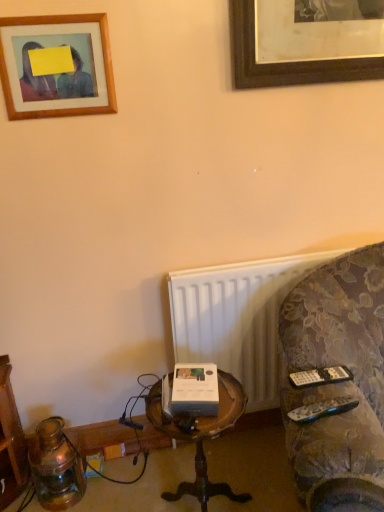
The image size is (384, 512). Describe the element at coordinates (56, 66) in the screenshot. I see `wooden picture frame at upper left` at that location.

The image size is (384, 512). Describe the element at coordinates (322, 409) in the screenshot. I see `black plastic remote at lower right, the second remote positioned from the back` at that location.

This screenshot has width=384, height=512. In order to click on antique brass lantern at lower left in this screenshot , I will do `click(56, 466)`.

In order to click on black plastic remote at right, the 1th remote in the back-to-front sequence in this screenshot , I will do `click(320, 376)`.

At what (x,y) coordinates should I click in order to perform the action: click on wooden picture frame at upper left. Please return your answer as a coordinate pair (x, y). The width and height of the screenshot is (384, 512). Looking at the image, I should click on (56, 66).

Are black plastic remote at lower right, the second remote positioned from the back, and white plastic radiator at lower right far apart?

black plastic remote at lower right, the second remote positioned from the back, is actually quite close to white plastic radiator at lower right.

How many degrees apart are the facing directions of black plastic remote at lower right, the second remote positioned from the back, and white plastic radiator at lower right?

The angular difference between black plastic remote at lower right, the second remote positioned from the back, and white plastic radiator at lower right is 4.05 degrees.

Which is more to the left, black plastic remote at lower right, the second remote positioned from the back, or white plastic radiator at lower right?

white plastic radiator at lower right is more to the left.

From a real-world perspective, between black plastic remote at lower right, which appears as the first remote when viewed from the front, and white plastic radiator at lower right, who is vertically higher?

From a 3D spatial view, black plastic remote at lower right, which appears as the first remote when viewed from the front, is above.

Considering the sizes of objects velvet-patterned couch at right and white plastic radiator at lower right in the image provided, who is thinner, velvet-patterned couch at right or white plastic radiator at lower right?

With smaller width is white plastic radiator at lower right.

Can you confirm if velvet-patterned couch at right is smaller than white plastic radiator at lower right?

No.

From a real-world perspective, does velvet-patterned couch at right stand above white plastic radiator at lower right?

Correct, in the physical world, velvet-patterned couch at right is higher than white plastic radiator at lower right.

Could you tell me if velvet-patterned couch at right is turned towards white plastic radiator at lower right?

No, velvet-patterned couch at right is not oriented towards white plastic radiator at lower right.

Find the location of a particular element. Image resolution: width=384 pixels, height=512 pixels. remote that is the 2nd object located above the velvet-patterned couch at right (from the image's perspective) is located at coordinates (320, 376).

Do you think black plastic remote at right, the 1th remote in the back-to-front sequence, is within velvet-patterned couch at right, or outside of it?

black plastic remote at right, the 1th remote in the back-to-front sequence, is inside velvet-patterned couch at right.

Does black plastic remote at right, which is the 2th remote from front to back, have a greater height compared to velvet-patterned couch at right?

In fact, black plastic remote at right, which is the 2th remote from front to back, may be shorter than velvet-patterned couch at right.

Considering the positions of objects black plastic remote at right, the 1th remote in the back-to-front sequence, and antique brass lantern at lower left in the image provided, who is more to the right, black plastic remote at right, the 1th remote in the back-to-front sequence, or antique brass lantern at lower left?

black plastic remote at right, the 1th remote in the back-to-front sequence, is more to the right.

Can you confirm if black plastic remote at right, which is the 2th remote from front to back, is thinner than antique brass lantern at lower left?

Yes.

Considering the positions of points (306, 374) and (70, 449), is point (306, 374) closer to camera compared to point (70, 449)?

Yes, point (306, 374) is in front of point (70, 449).

Find the location of a particular element. the 2nd remote in front of the white plastic radiator at lower right is located at coordinates (322, 409).

How many degrees apart are the facing directions of white plastic radiator at lower right and black plastic remote at lower right, the second remote positioned from the back?

The angle between the facing direction of white plastic radiator at lower right and the facing direction of black plastic remote at lower right, the second remote positioned from the back, is 4.05 degrees.

Are white plastic radiator at lower right and black plastic remote at lower right, which appears as the first remote when viewed from the front, making contact?

white plastic radiator at lower right and black plastic remote at lower right, which appears as the first remote when viewed from the front, are not in contact.

Could black plastic remote at lower right, which appears as the first remote when viewed from the front, be considered to be inside white plastic radiator at lower right?

No, white plastic radiator at lower right does not contain black plastic remote at lower right, which appears as the first remote when viewed from the front.

Would you consider black plastic remote at right, the 1th remote in the back-to-front sequence, to be distant from wooden picture frame at upper left?

Absolutely, black plastic remote at right, the 1th remote in the back-to-front sequence, is distant from wooden picture frame at upper left.

Consider the image. Between black plastic remote at right, the 1th remote in the back-to-front sequence, and wooden picture frame at upper left, which one has smaller size?

Smaller between the two is black plastic remote at right, the 1th remote in the back-to-front sequence.

From a real-world perspective, who is located higher, black plastic remote at right, which is the 2th remote from front to back, or wooden picture frame at upper left?

wooden picture frame at upper left.

Is black plastic remote at right, the 1th remote in the back-to-front sequence, thinner than wooden picture frame at upper left?

In fact, black plastic remote at right, the 1th remote in the back-to-front sequence, might be wider than wooden picture frame at upper left.

From a real-world perspective, who is located lower, antique brass lantern at lower left or black plastic remote at right, which is the 2th remote from front to back?

antique brass lantern at lower left, from a real-world perspective.

Is antique brass lantern at lower left to the left or to the right of black plastic remote at right, the 1th remote in the back-to-front sequence, in the image?

In the image, antique brass lantern at lower left appears on the left side of black plastic remote at right, the 1th remote in the back-to-front sequence.

Is antique brass lantern at lower left bigger than black plastic remote at right, which is the 2th remote from front to back?

Indeed, antique brass lantern at lower left has a larger size compared to black plastic remote at right, which is the 2th remote from front to back.

In terms of width, does antique brass lantern at lower left look wider or thinner when compared to black plastic remote at right, the 1th remote in the back-to-front sequence?

Considering their sizes, antique brass lantern at lower left looks broader than black plastic remote at right, the 1th remote in the back-to-front sequence.

Locate an element on the screen. Image resolution: width=384 pixels, height=512 pixels. remote that is the 2nd one when counting forward from the white plastic radiator at lower right is located at coordinates coord(322,409).

Image resolution: width=384 pixels, height=512 pixels. I want to click on studio couch below the white plastic radiator at lower right (from the image's perspective), so click(x=338, y=383).

Based on their spatial positions, is antique brass lantern at lower left or white plastic radiator at lower right further from wooden picture frame at upper left?

The object further to wooden picture frame at upper left is antique brass lantern at lower left.

Based on their spatial positions, is velvet-patterned couch at right or white plastic radiator at lower right closer to black plastic remote at right, the 1th remote in the back-to-front sequence?

velvet-patterned couch at right.

Which object lies nearer to the anchor point white plastic radiator at lower right, black plastic remote at right, which is the 2th remote from front to back, or antique brass lantern at lower left?

black plastic remote at right, which is the 2th remote from front to back, is closer to white plastic radiator at lower right.

Looking at the image, which one is located further to black plastic remote at right, the 1th remote in the back-to-front sequence, wooden picture frame at upper left or velvet-patterned couch at right?

wooden picture frame at upper left is further to black plastic remote at right, the 1th remote in the back-to-front sequence.

Considering their positions, is wooden picture frame at upper left positioned further to woodenobject at center than black plastic remote at lower right, which appears as the first remote when viewed from the front?

wooden picture frame at upper left.

Based on their spatial positions, is black plastic remote at right, the 1th remote in the back-to-front sequence, or black plastic remote at lower right, the second remote positioned from the back, closer to wooden picture frame at upper left?

Among the two, black plastic remote at right, the 1th remote in the back-to-front sequence, is located nearer to wooden picture frame at upper left.

When comparing their distances from white plastic radiator at lower right, does black plastic remote at right, the 1th remote in the back-to-front sequence, or woodenobject at center seem closer?

The object closer to white plastic radiator at lower right is woodenobject at center.

Looking at the image, which one is located further to wooden picture frame at upper left, woodenobject at center or black plastic remote at right, which is the 2th remote from front to back?

black plastic remote at right, which is the 2th remote from front to back.

The height and width of the screenshot is (512, 384). In order to click on table located between antique brass lantern at lower left and black plastic remote at right, which is the 2th remote from front to back, in the left-right direction in this screenshot , I will do `click(199, 434)`.

What are the coordinates of `radiator between antique brass lantern at lower left and black plastic remote at lower right, which appears as the first remote when viewed from the front` in the screenshot? It's located at (237, 318).

Where is `table located between antique brass lantern at lower left and black plastic remote at lower right, which appears as the first remote when viewed from the front, in the left-right direction`? The height and width of the screenshot is (512, 384). table located between antique brass lantern at lower left and black plastic remote at lower right, which appears as the first remote when viewed from the front, in the left-right direction is located at coordinates (199, 434).

At what (x,y) coordinates should I click in order to perform the action: click on remote between velvet-patterned couch at right and woodenobject at center from front to back. Please return your answer as a coordinate pair (x, y). The width and height of the screenshot is (384, 512). Looking at the image, I should click on (322, 409).